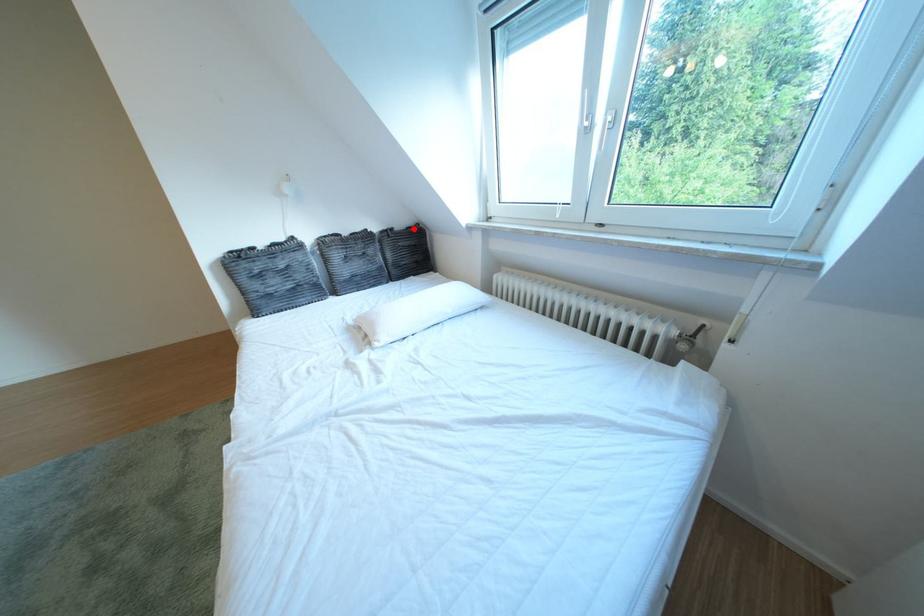
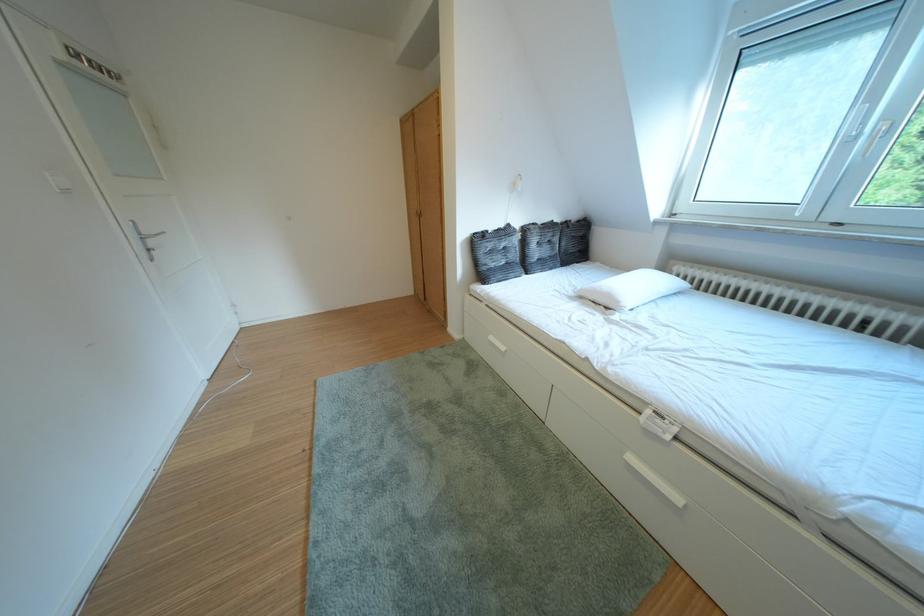
Where in the second image is the point corresponding to the highlighted location from the first image?

(588, 222)